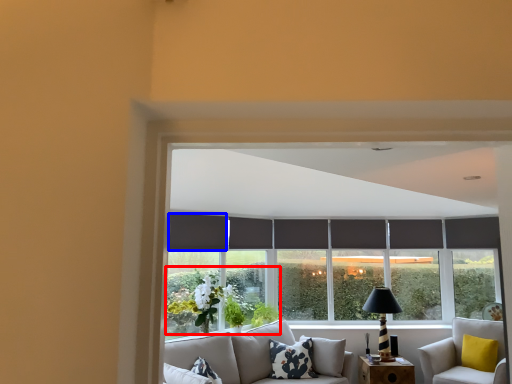
Question: Which point is further to the camera, plant (highlighted by a red box) or curtain (highlighted by a blue box)?

Choices:
 (A) plant
 (B) curtain

Answer: (B)